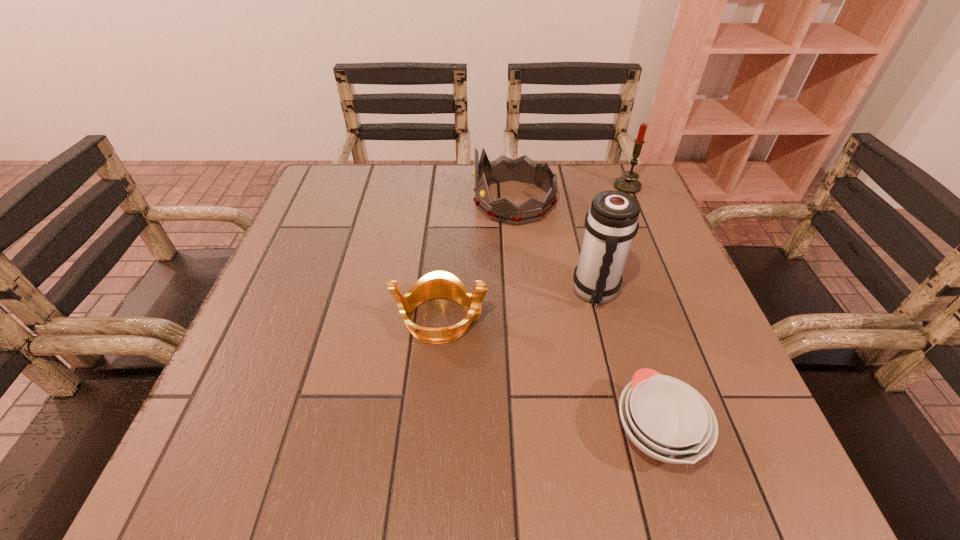
Where is `candle located in the right edge section of the desktop`? The image size is (960, 540). candle located in the right edge section of the desktop is located at coordinates (628, 183).

Identify the location of soup bowl present at the right edge. point(667,419).

I want to click on object present at the far right corner, so click(x=628, y=183).

This screenshot has height=540, width=960. I want to click on object located in the near right corner section of the desktop, so click(x=667, y=419).

You are a GUI agent. You are given a task and a screenshot of the screen. Output one action in this format:
    pyautogui.click(x=<x>, y=<y>)
    Task: Click on the vacant position at the far edge of the desktop
    Image resolution: width=960 pixels, height=540 pixels.
    Given the screenshot: What is the action you would take?
    pyautogui.click(x=568, y=184)

Where is `vacant space at the left edge of the desktop`? vacant space at the left edge of the desktop is located at coordinates (312, 294).

Locate an element on the screen. vacant space at the right edge of the desktop is located at coordinates (662, 234).

Locate an element on the screen. free space at the far left corner of the desktop is located at coordinates (316, 195).

Locate an element on the screen. This screenshot has width=960, height=540. vacant space at the far right corner of the desktop is located at coordinates (592, 174).

Find the location of `free location at the near right corner`. free location at the near right corner is located at coordinates (704, 486).